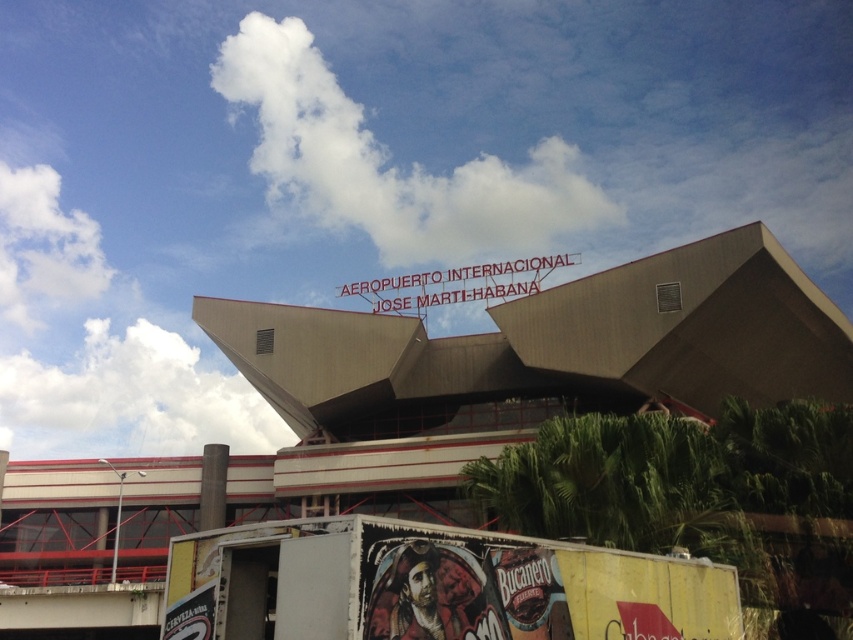
Question: From the image, what is the correct spatial relationship of yellow matte trailer truck at lower center in relation to white fluffy cloud at upper left?

Choices:
 (A) below
 (B) above

Answer: (B)

Question: Which object appears closest to the camera in this image?

Choices:
 (A) yellow matte trailer truck at lower center
 (B) white fluffy cloud at upper center
 (C) brown corrugated metal building at center
 (D) white fluffy cloud at upper left

Answer: (A)

Question: Which of the following is the closest to the observer?

Choices:
 (A) yellow matte trailer truck at lower center
 (B) brown corrugated metal building at center
 (C) white fluffy cloud at upper left
 (D) white fluffy cloud at upper center

Answer: (A)

Question: Which point is farther to the camera?

Choices:
 (A) (287, 582)
 (B) (140, 513)

Answer: (B)

Question: Is brown corrugated metal building at center below yellow matte trailer truck at lower center?

Choices:
 (A) no
 (B) yes

Answer: (A)

Question: Can you confirm if yellow matte trailer truck at lower center is thinner than white fluffy cloud at upper left?

Choices:
 (A) yes
 (B) no

Answer: (A)